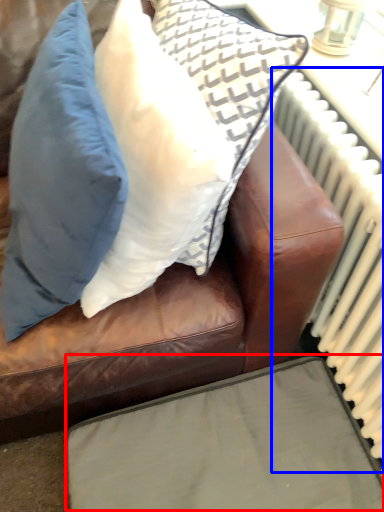
Question: Which object appears farthest to the camera in this image, furniture (highlighted by a red box) or radiator (highlighted by a blue box)?

Choices:
 (A) furniture
 (B) radiator

Answer: (A)